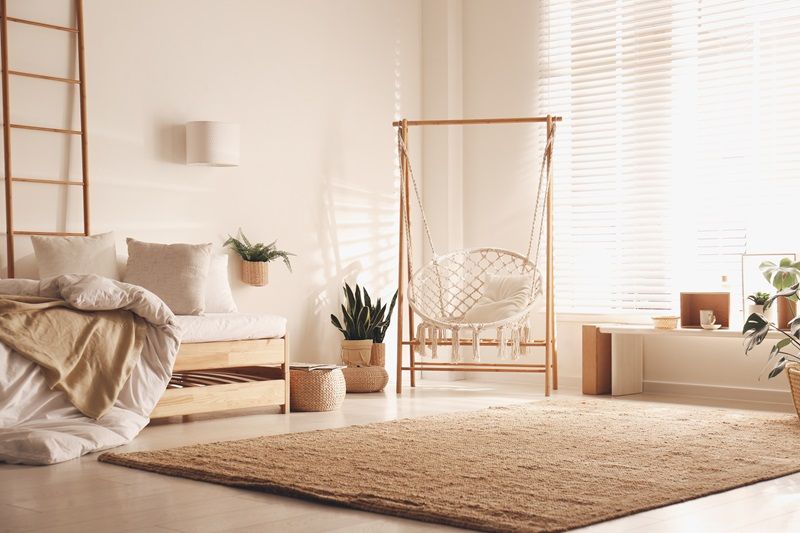
Locate an element on the screen. The width and height of the screenshot is (800, 533). throw pillows is located at coordinates (69, 244), (169, 263).